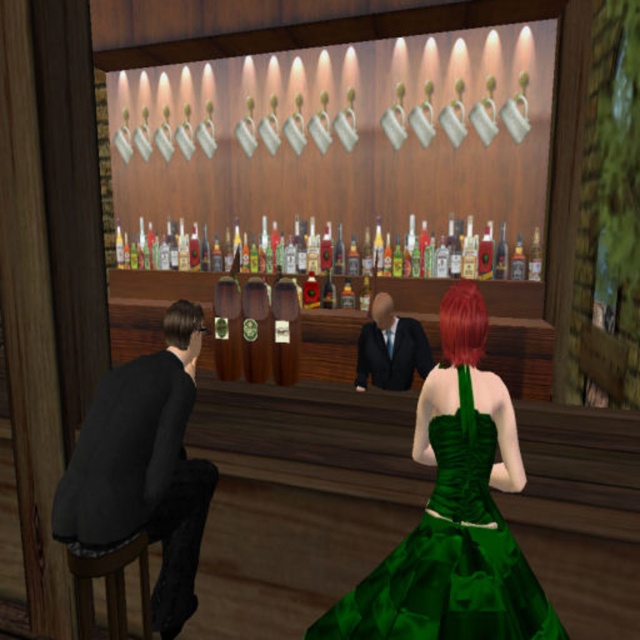
From the picture: Between shiny black suit at center and shiny red hair at center, which one is positioned lower?

shiny black suit at center is below.

Which is in front, point (388, 360) or point (444, 355)?

Point (444, 355)

The image size is (640, 640). Find the location of `shiny black suit at center`. shiny black suit at center is located at coordinates (390, 348).

Find the location of a particular element. This screenshot has width=640, height=640. shiny black suit at center is located at coordinates (390, 348).

Looking at this image, is green satin dress at center to the right of shiny black suit at center from the viewer's perspective?

Incorrect, green satin dress at center is not on the right side of shiny black suit at center.

Who is positioned more to the left, green satin dress at center or shiny black suit at center?

green satin dress at center is more to the left.

Which is in front, point (492, 532) or point (380, 358)?

Point (492, 532) is more forward.

Locate an element on the screen. green satin dress at center is located at coordinates (449, 557).

Is point (177, 248) closer to viewer compared to point (378, 326)?

That is False.

This screenshot has width=640, height=640. What do you see at coordinates (164, 250) in the screenshot?
I see `shiny glass bottles at center` at bounding box center [164, 250].

In order to click on shiny glass bottles at center in this screenshot , I will do `click(164, 250)`.